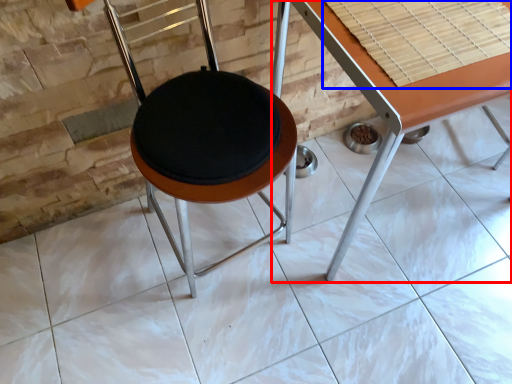
Question: Which of the following is the closest to the observer, table (highlighted by a red box) or table top (highlighted by a blue box)?

Choices:
 (A) table
 (B) table top

Answer: (A)